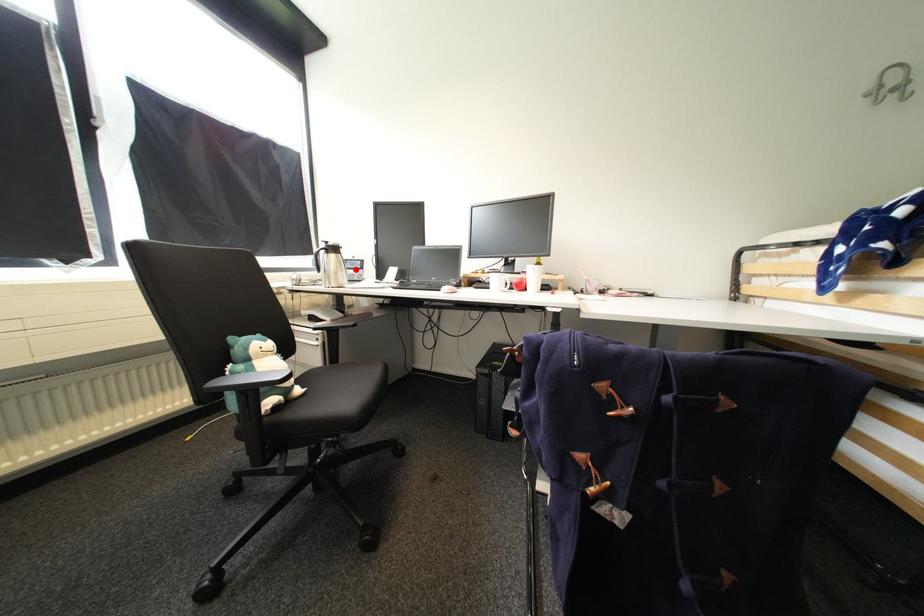
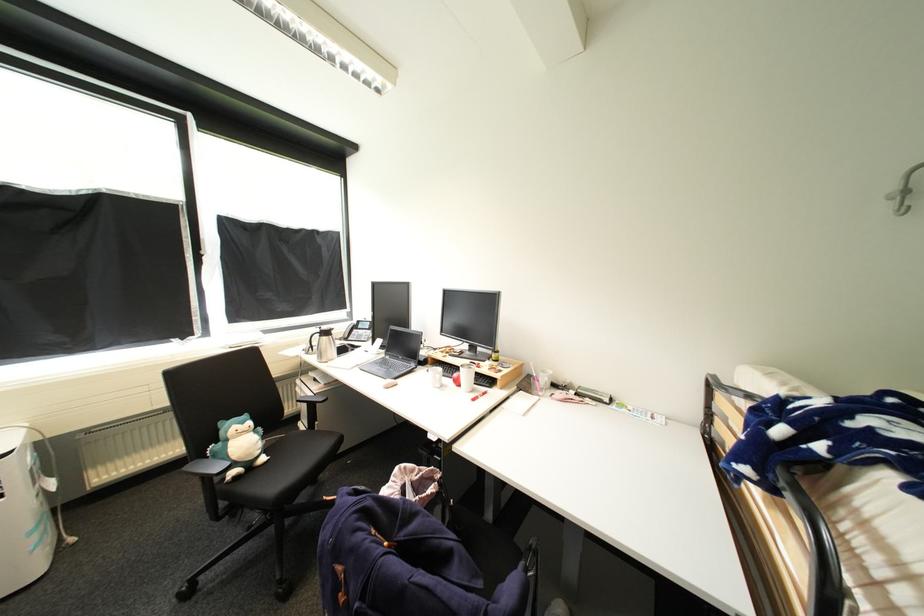
Question: I am providing you with two images of the same scene from different viewpoints. A red point is shown in image1. For the corresponding object point in image2, is it positioned nearer or farther from the camera?

Choices:
 (A) Nearer
 (B) Farther

Answer: (B)